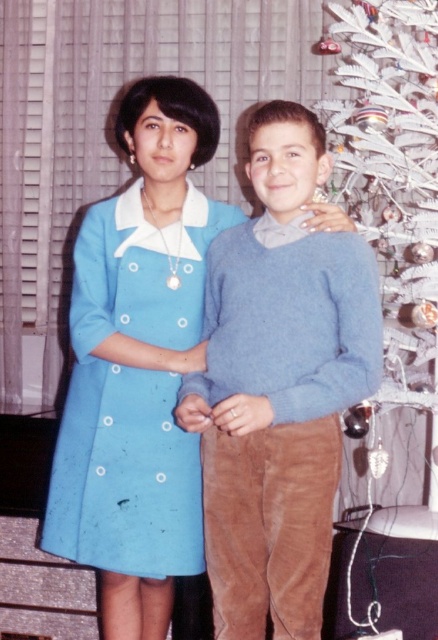
Question: Is light blue sweater at center below white feather christmas tree at right?

Choices:
 (A) yes
 (B) no

Answer: (A)

Question: Which object is the farthest from the light blue sweater at center?

Choices:
 (A) white feather christmas tree at right
 (B) matte blue dress at center

Answer: (A)

Question: Which point is closer to the camera?

Choices:
 (A) (131, 502)
 (B) (334, 252)

Answer: (B)

Question: Among these points, which one is nearest to the camera?

Choices:
 (A) (187, 529)
 (B) (360, 54)

Answer: (A)

Question: Can you confirm if matte blue dress at center is positioned below white feather christmas tree at right?

Choices:
 (A) no
 (B) yes

Answer: (B)

Question: Can you confirm if light blue sweater at center is bigger than matte blue dress at center?

Choices:
 (A) no
 (B) yes

Answer: (B)